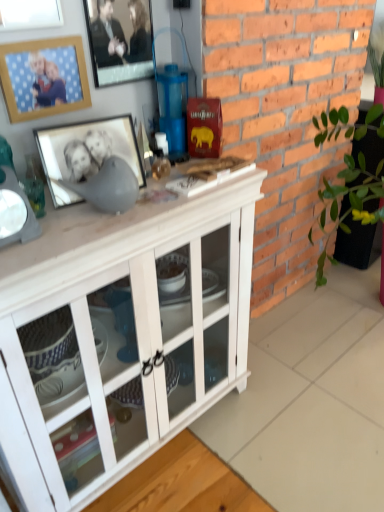
Question: Is wooden picture frame at upper left, the second picture frame from the bottom, to the right of metallic silver picture frame at upper center, acting as the 1th picture frame starting from the top, from the viewer's perspective?

Choices:
 (A) no
 (B) yes

Answer: (A)

Question: Is wooden picture frame at upper left, arranged as the 2th picture frame when viewed from the top, surrounding metallic silver picture frame at upper center, arranged as the third picture frame when ordered from the bottom?

Choices:
 (A) no
 (B) yes

Answer: (A)

Question: Does wooden picture frame at upper left, arranged as the 2th picture frame when viewed from the top, turn towards metallic silver picture frame at upper center, arranged as the third picture frame when ordered from the bottom?

Choices:
 (A) no
 (B) yes

Answer: (A)

Question: Considering the relative sizes of wooden picture frame at upper left, the second picture frame from the bottom, and metallic silver picture frame at upper center, arranged as the third picture frame when ordered from the bottom, in the image provided, is wooden picture frame at upper left, the second picture frame from the bottom, shorter than metallic silver picture frame at upper center, arranged as the third picture frame when ordered from the bottom,?

Choices:
 (A) no
 (B) yes

Answer: (B)

Question: From the image's perspective, would you say wooden picture frame at upper left, arranged as the 2th picture frame when viewed from the top, is shown under metallic silver picture frame at upper center, arranged as the third picture frame when ordered from the bottom?

Choices:
 (A) no
 (B) yes

Answer: (B)

Question: From the image's perspective, does wooden picture frame at upper left, arranged as the 2th picture frame when viewed from the top, appear higher than metallic silver picture frame at upper center, acting as the 1th picture frame starting from the top?

Choices:
 (A) yes
 (B) no

Answer: (B)

Question: Considering the relative sizes of brick at right and matte black picture frame at upper left, which is the 3th picture frame from top to bottom, in the image provided, is brick at right smaller than matte black picture frame at upper left, which is the 3th picture frame from top to bottom,?

Choices:
 (A) no
 (B) yes

Answer: (A)

Question: Is brick at right bigger than matte black picture frame at upper left, marked as the first picture frame in a bottom-to-top arrangement?

Choices:
 (A) yes
 (B) no

Answer: (A)

Question: Is matte black picture frame at upper left, which is the 3th picture frame from top to bottom, located within brick at right?

Choices:
 (A) no
 (B) yes

Answer: (A)

Question: Are brick at right and matte black picture frame at upper left, which is the 3th picture frame from top to bottom, located far from each other?

Choices:
 (A) yes
 (B) no

Answer: (B)

Question: Does brick at right appear on the left side of matte black picture frame at upper left, marked as the first picture frame in a bottom-to-top arrangement?

Choices:
 (A) yes
 (B) no

Answer: (B)

Question: From a real-world perspective, is brick at right over matte black picture frame at upper left, marked as the first picture frame in a bottom-to-top arrangement?

Choices:
 (A) no
 (B) yes

Answer: (A)

Question: Does wooden picture frame at upper left, arranged as the 2th picture frame when viewed from the top, come behind white wood cabinet at center?

Choices:
 (A) no
 (B) yes

Answer: (B)